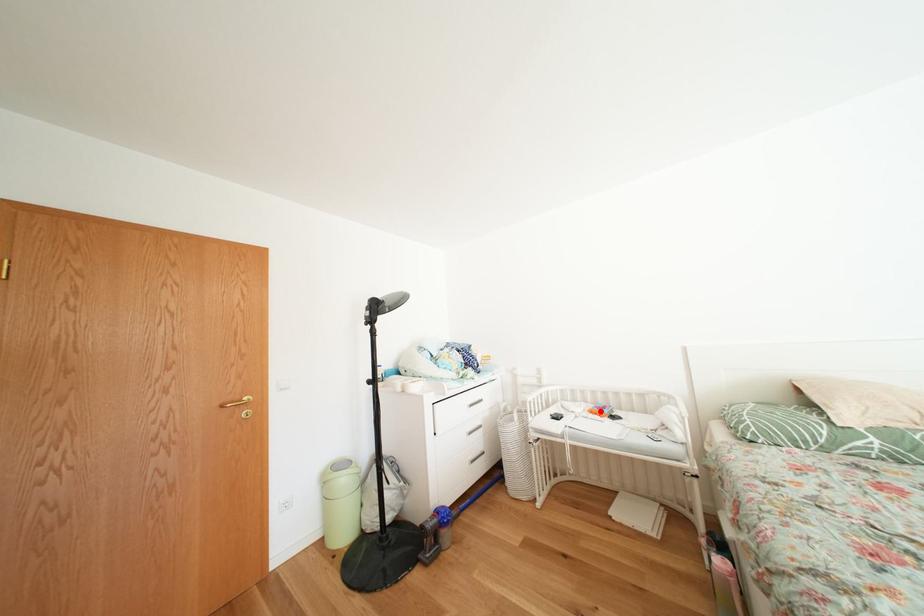
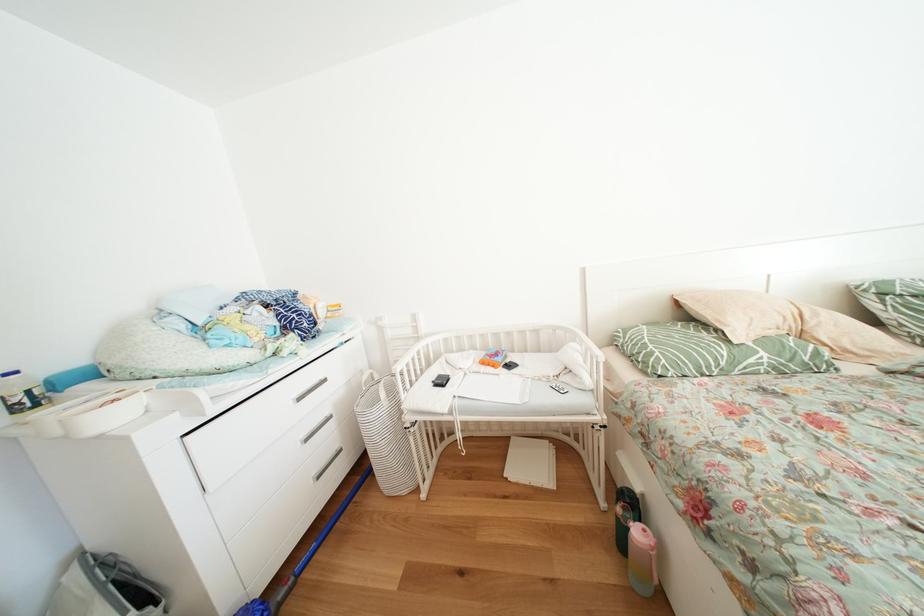
Where in the second image is the point corresponding to the highlighted location from the first image?

(491, 360)